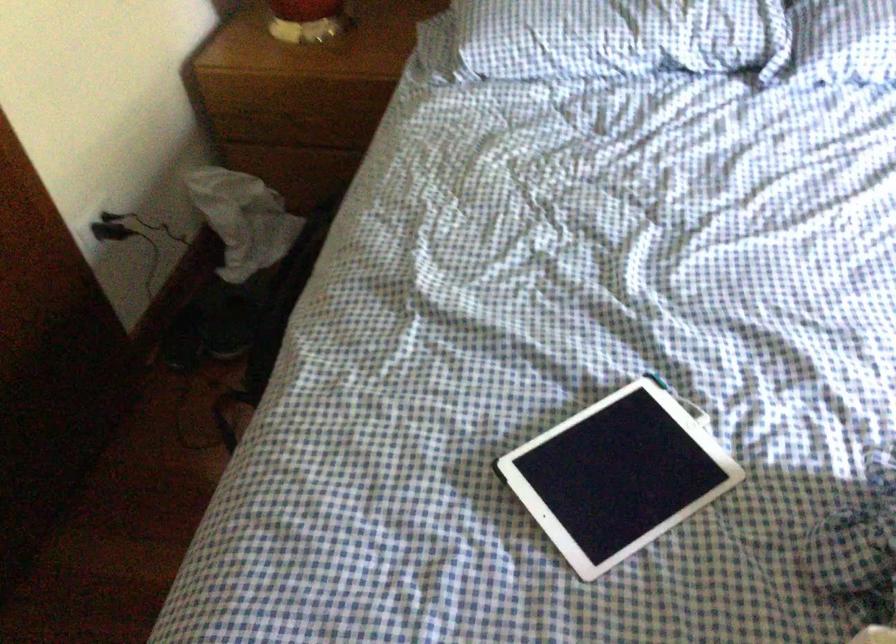
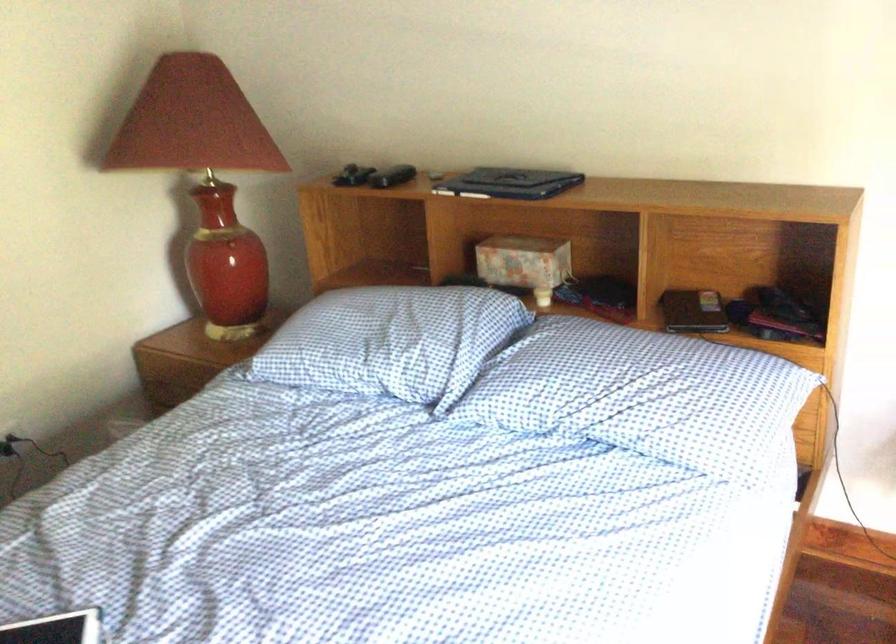
Where in the second image is the point corresponding to pixel 612 424 from the first image?

(56, 629)